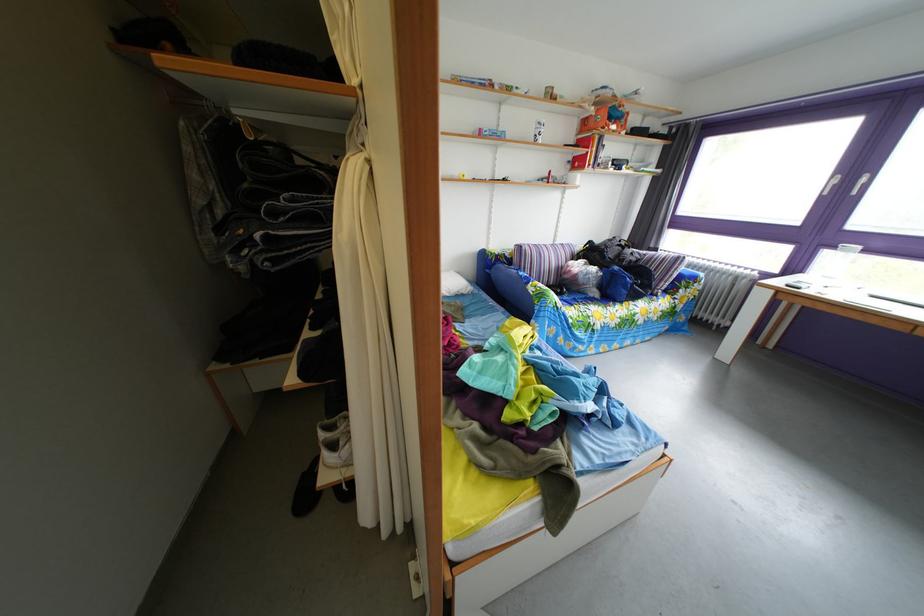
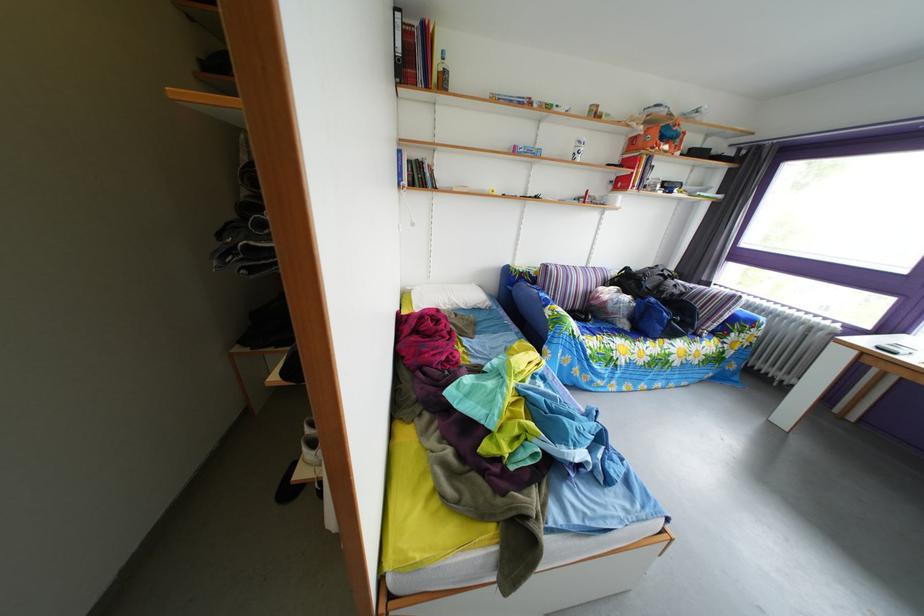
Locate, in the second image, the point that corresponds to (x=505, y=272) in the first image.

(529, 289)